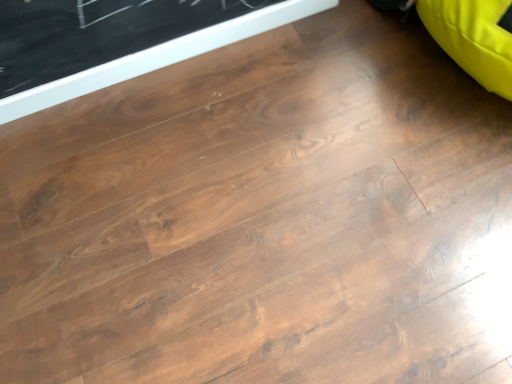
I want to click on free location to the right of matte wood bulletin board at upper left, so click(x=332, y=102).